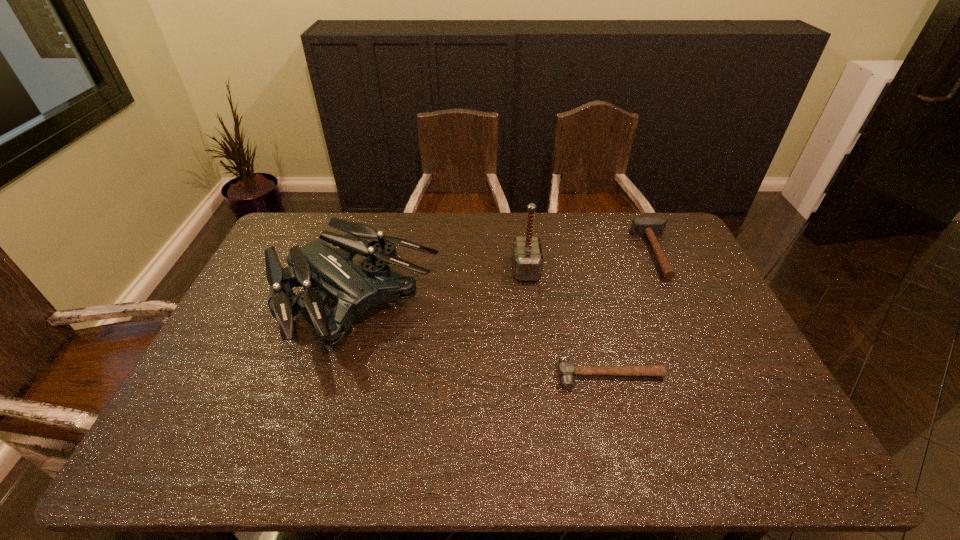
Locate an element on the screen. This screenshot has height=540, width=960. vacant space that satisfies the following two spatial constraints: 1. on the striking surface of the second shortest object; 2. on the striking face of the second object from right to left is located at coordinates (716, 375).